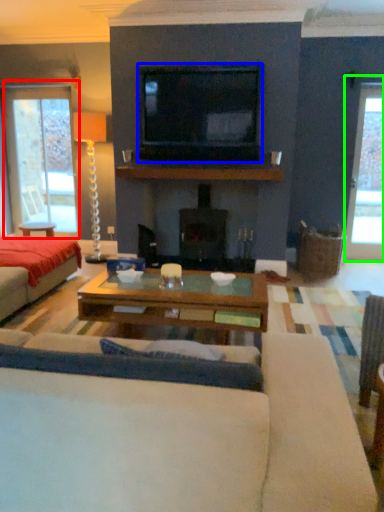
Question: Estimate the real-world distances between objects in this image. Which object is farther from window (highlighted by a red box), television (highlighted by a blue box) or window (highlighted by a green box)?

Choices:
 (A) television
 (B) window

Answer: (B)